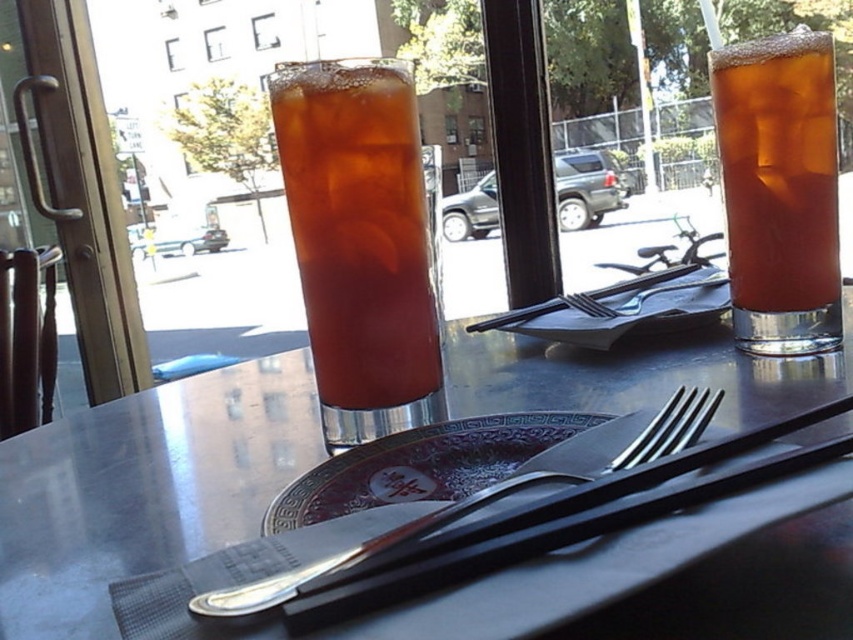
How far apart are shiny silver fork at center and silver plated fork at center?

They are 5.28 inches apart.

Who is more forward, (770, 556) or (387, 531)?

Point (770, 556) is in front.

Between point (476, 628) and point (624, 452), which one is positioned in front?

Positioned in front is point (476, 628).

Find the location of a particular element. This screenshot has width=853, height=640. shiny silver fork at center is located at coordinates (144, 488).

Is point (343, 134) positioned behind point (641, 452)?

Yes, point (343, 134) is behind point (641, 452).

Identify the location of brown matte glass at center. This screenshot has width=853, height=640. (358, 228).

Who is more distant from viewer, (367, 333) or (250, 612)?

Positioned behind is point (367, 333).

Locate an element on the screen. brown matte glass at center is located at coordinates (358, 228).

Is the position of brown glass ice tea at upper right less distant than that of silver plated fork at center?

No, brown glass ice tea at upper right is behind silver plated fork at center.

Describe the element at coordinates (779, 189) in the screenshot. I see `brown glass ice tea at upper right` at that location.

Identify the location of brown glass ice tea at upper right. The image size is (853, 640). pyautogui.click(x=779, y=189).